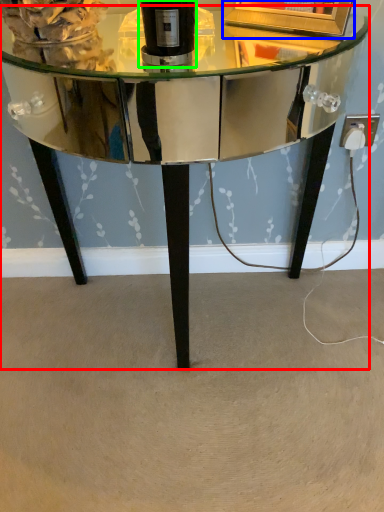
Question: Based on their relative distances, which object is farther from table (highlighted by a red box)? Choose from picture frame (highlighted by a blue box) and bottle (highlighted by a green box).

Choices:
 (A) picture frame
 (B) bottle

Answer: (B)